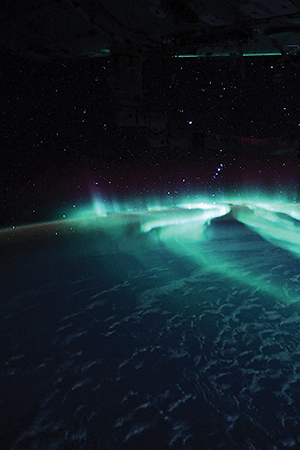
In order to click on long green lights in this screenshot , I will do `click(181, 56)`, `click(265, 53)`, `click(223, 54)`.